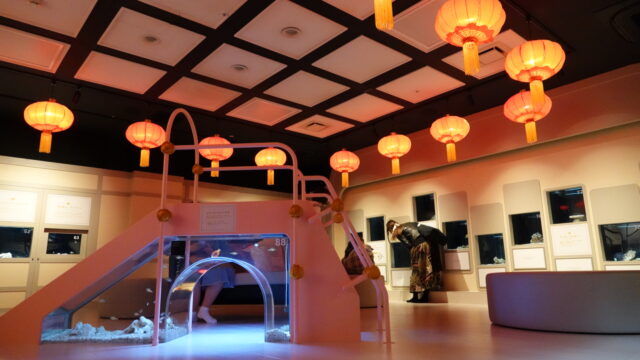
The height and width of the screenshot is (360, 640). What are the coordinates of `desk` in the screenshot? It's located at click(x=573, y=308).